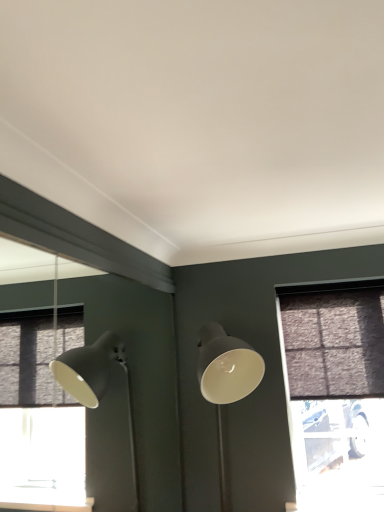
Question: Does brown textured curtain at right lie behind textured dark gray window at right?

Choices:
 (A) no
 (B) yes

Answer: (A)

Question: Can you confirm if brown textured curtain at right is taller than textured dark gray window at right?

Choices:
 (A) no
 (B) yes

Answer: (A)

Question: Is brown textured curtain at right to the right of textured dark gray window at right from the viewer's perspective?

Choices:
 (A) yes
 (B) no

Answer: (A)

Question: Is brown textured curtain at right not close to textured dark gray window at right?

Choices:
 (A) no
 (B) yes

Answer: (A)

Question: Considering the relative sizes of brown textured curtain at right and textured dark gray window at right in the image provided, is brown textured curtain at right shorter than textured dark gray window at right?

Choices:
 (A) yes
 (B) no

Answer: (A)

Question: Is brown textured curtain at right smaller than textured dark gray window at right?

Choices:
 (A) yes
 (B) no

Answer: (A)

Question: Does textured dark gray window at right have a greater height compared to matte gray lamp at center?

Choices:
 (A) no
 (B) yes

Answer: (B)

Question: Is textured dark gray window at right turned away from matte gray lamp at center?

Choices:
 (A) no
 (B) yes

Answer: (A)

Question: Is textured dark gray window at right located outside matte gray lamp at center?

Choices:
 (A) no
 (B) yes

Answer: (B)

Question: Are textured dark gray window at right and matte gray lamp at center far apart?

Choices:
 (A) yes
 (B) no

Answer: (B)

Question: Is textured dark gray window at right wider than matte gray lamp at center?

Choices:
 (A) no
 (B) yes

Answer: (A)

Question: Is textured dark gray window at right placed right next to matte gray lamp at center?

Choices:
 (A) no
 (B) yes

Answer: (A)

Question: From a real-world perspective, is matte gray lamp at center physically below brown textured curtain at right?

Choices:
 (A) no
 (B) yes

Answer: (B)